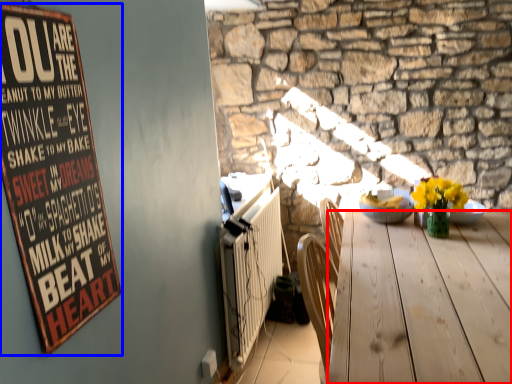
Question: Which object appears farthest to the camera in this image, desk (highlighted by a red box) or bulletin board (highlighted by a blue box)?

Choices:
 (A) desk
 (B) bulletin board

Answer: (A)